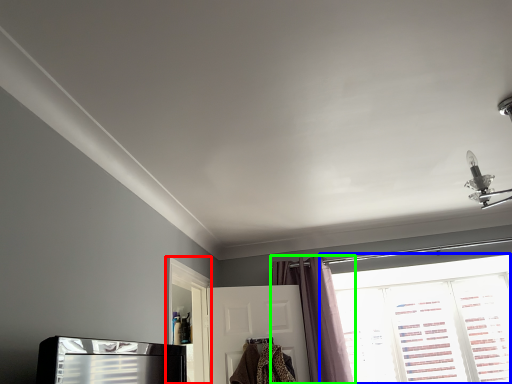
Question: Based on their relative distances, which object is nearer to screen door (highlighted by a red box)? Choose from window (highlighted by a blue box) and curtain (highlighted by a green box).

Choices:
 (A) window
 (B) curtain

Answer: (B)